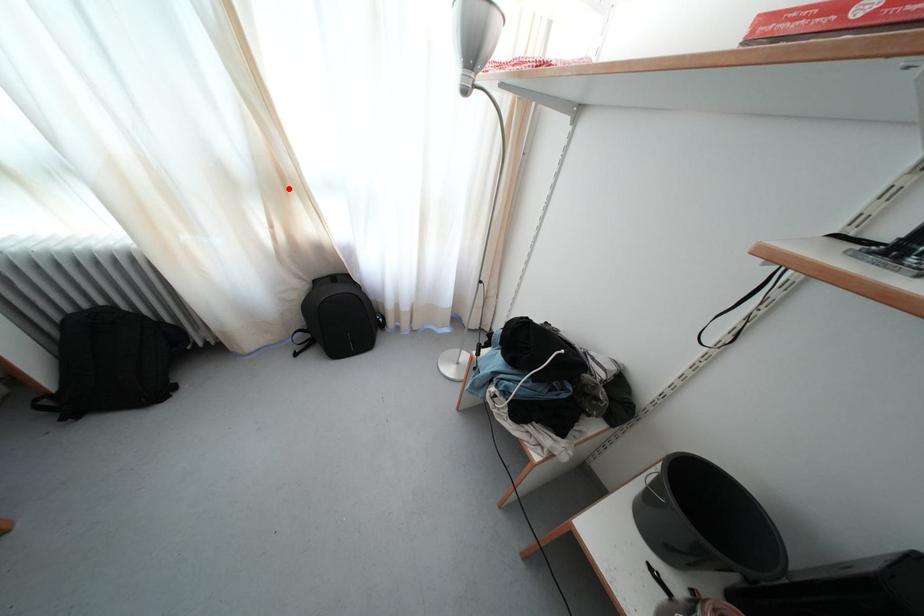
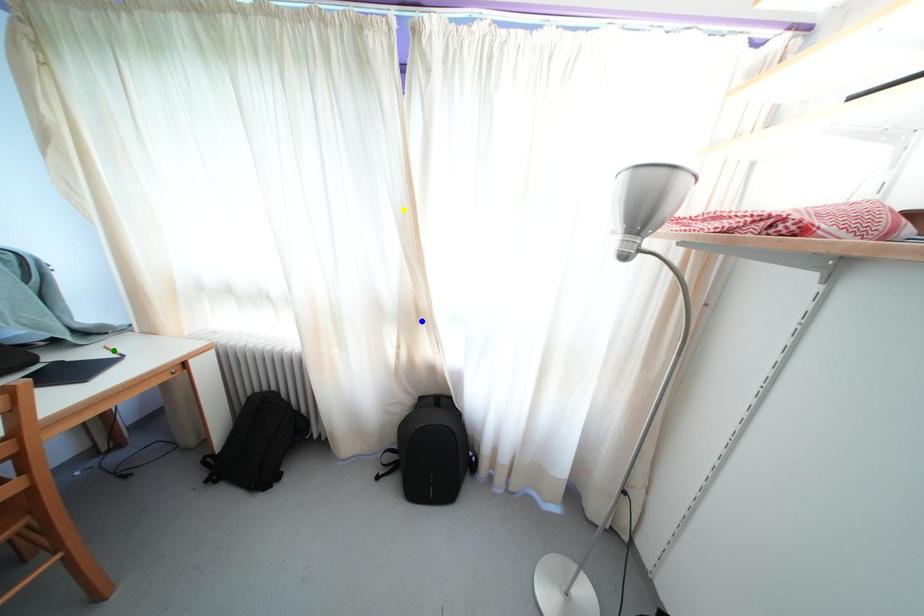
Question: I am providing you with two images of the same scene from different viewpoints. A red point is marked on the first image. You are given multiple points on the second image. Can you choose the point in image 2 that corresponds to the point in image 1?

Choices:
 (A) yellow point
 (B) green point
 (C) blue point

Answer: (C)